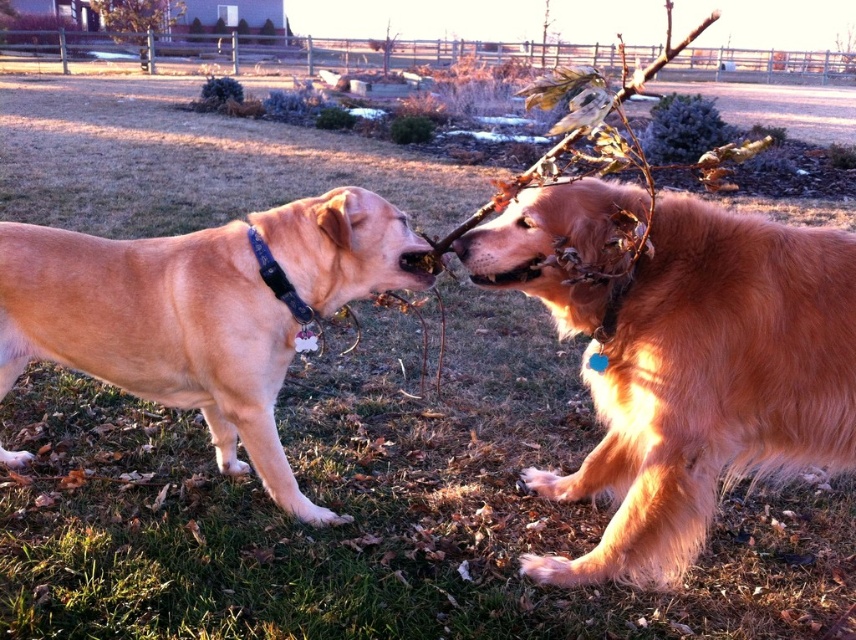
You are a dog trainer observing two dogs playing with a branch. The dogs are the golden fur dog at right and the golden fur dog at left. You need to place a treat between them so both can reach it easily. How far apart should you place the treat from each dog?

The golden fur dog at right and golden fur dog at left are 31.40 inches apart. To ensure both dogs can reach the treat easily, place it exactly halfway between them, which would be 15.70 inches from each dog.

You are a dog owner who wants to buy matching collars for both dogs. The store only has collars that fit dogs up to 30 inches in height. Given that the golden fur dog at right is larger than the golden fur dog at left, which dog might need a larger collar?

The golden fur dog at right requires a larger collar since it is bigger in size compared to the golden fur dog at left.